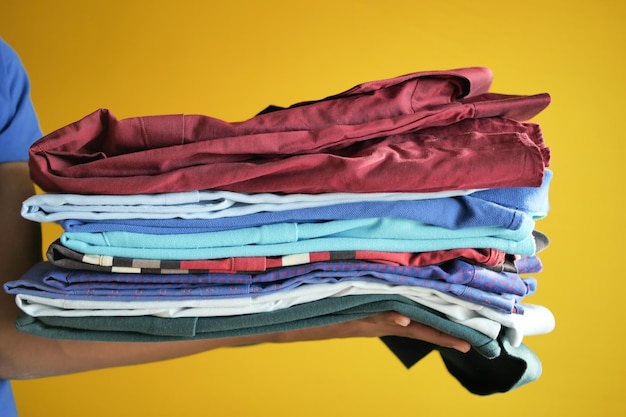
What are the coordinates of `folded shirts` in the screenshot? It's located at (392, 163), (345, 196), (250, 221), (243, 241), (235, 264), (218, 278), (193, 294), (183, 308), (178, 331).